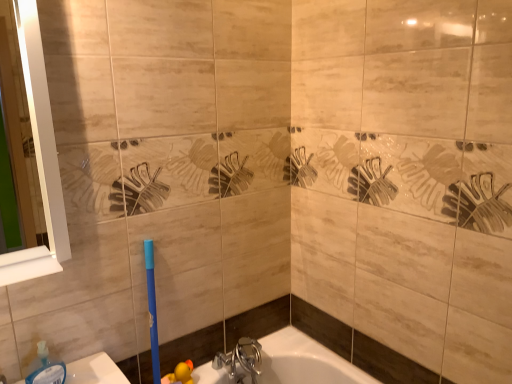
Question: Should I look upward or downward to see chrome metallic faucet at lower center?

Choices:
 (A) up
 (B) down

Answer: (B)

Question: Considering the relative sizes of white glossy mirror at left and translucent plastic soap dispenser at lower left in the image provided, is white glossy mirror at left taller than translucent plastic soap dispenser at lower left?

Choices:
 (A) yes
 (B) no

Answer: (A)

Question: Is white glossy mirror at left with translucent plastic soap dispenser at lower left?

Choices:
 (A) no
 (B) yes

Answer: (A)

Question: Is white glossy mirror at left wider than translucent plastic soap dispenser at lower left?

Choices:
 (A) no
 (B) yes

Answer: (B)

Question: Does white glossy mirror at left have a lesser width compared to translucent plastic soap dispenser at lower left?

Choices:
 (A) yes
 (B) no

Answer: (B)

Question: Considering the relative positions of white glossy mirror at left and translucent plastic soap dispenser at lower left in the image provided, is white glossy mirror at left to the left of translucent plastic soap dispenser at lower left from the viewer's perspective?

Choices:
 (A) yes
 (B) no

Answer: (B)

Question: From a real-world perspective, is white glossy mirror at left physically above translucent plastic soap dispenser at lower left?

Choices:
 (A) yes
 (B) no

Answer: (A)

Question: Is translucent plastic soap dispenser at lower left positioned behind white glossy mirror at left?

Choices:
 (A) no
 (B) yes

Answer: (B)

Question: Can you confirm if translucent plastic soap dispenser at lower left is shorter than white glossy mirror at left?

Choices:
 (A) yes
 (B) no

Answer: (A)

Question: Does translucent plastic soap dispenser at lower left lie in front of white glossy mirror at left?

Choices:
 (A) yes
 (B) no

Answer: (B)

Question: Considering the relative sizes of translucent plastic soap dispenser at lower left and white glossy mirror at left in the image provided, is translucent plastic soap dispenser at lower left smaller than white glossy mirror at left?

Choices:
 (A) no
 (B) yes

Answer: (B)

Question: Considering the relative sizes of translucent plastic soap dispenser at lower left and white glossy mirror at left in the image provided, is translucent plastic soap dispenser at lower left bigger than white glossy mirror at left?

Choices:
 (A) no
 (B) yes

Answer: (A)

Question: From the image's perspective, is translucent plastic soap dispenser at lower left located above white glossy mirror at left?

Choices:
 (A) yes
 (B) no

Answer: (B)

Question: Is chrome metallic faucet at lower center in front of translucent plastic soap dispenser at lower left?

Choices:
 (A) no
 (B) yes

Answer: (A)